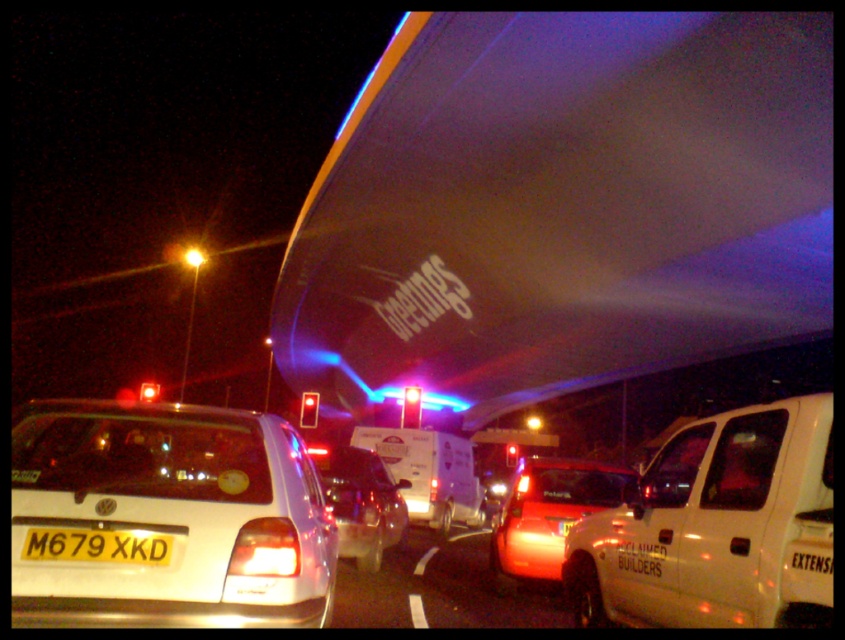
Locate an element on the screen. This screenshot has width=845, height=640. metallic red car at center is located at coordinates tap(440, 588).

In the scene shown: Which of these two, metallic red car at center or shiny silver sedan at center, stands shorter?

Standing shorter between the two is shiny silver sedan at center.

What do you see at coordinates (440, 588) in the screenshot? The image size is (845, 640). I see `metallic red car at center` at bounding box center [440, 588].

You are a GUI agent. You are given a task and a screenshot of the screen. Output one action in this format:
    pyautogui.click(x=<x>, y=<y>)
    Task: Click on the metallic red car at center
    The image size is (845, 640).
    Given the screenshot: What is the action you would take?
    pyautogui.click(x=440, y=588)

Locate an element on the screen. yellow metallic license plate at center is located at coordinates (97, 545).

Between yellow metallic license plate at center and bright yellow light at upper center, which one has more height?

bright yellow light at upper center is taller.

The height and width of the screenshot is (640, 845). Find the location of `yellow metallic license plate at center`. yellow metallic license plate at center is located at coordinates (97, 545).

Which is more to the right, matte red car at center or bright yellow light at upper center?

From the viewer's perspective, matte red car at center appears more on the right side.

Who is shorter, matte red car at center or bright yellow light at upper center?

With less height is matte red car at center.

Locate an element on the screen. The height and width of the screenshot is (640, 845). matte red car at center is located at coordinates (549, 515).

Locate an element on the screen. matte red car at center is located at coordinates (549, 515).